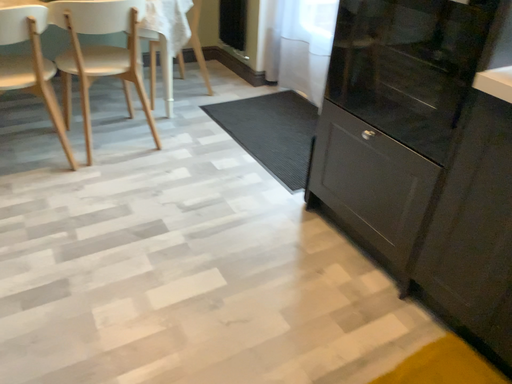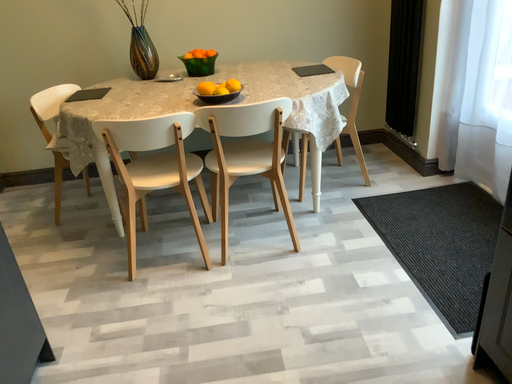
Question: How did the camera likely rotate when shooting the video?

Choices:
 (A) rotated left
 (B) rotated right

Answer: (A)